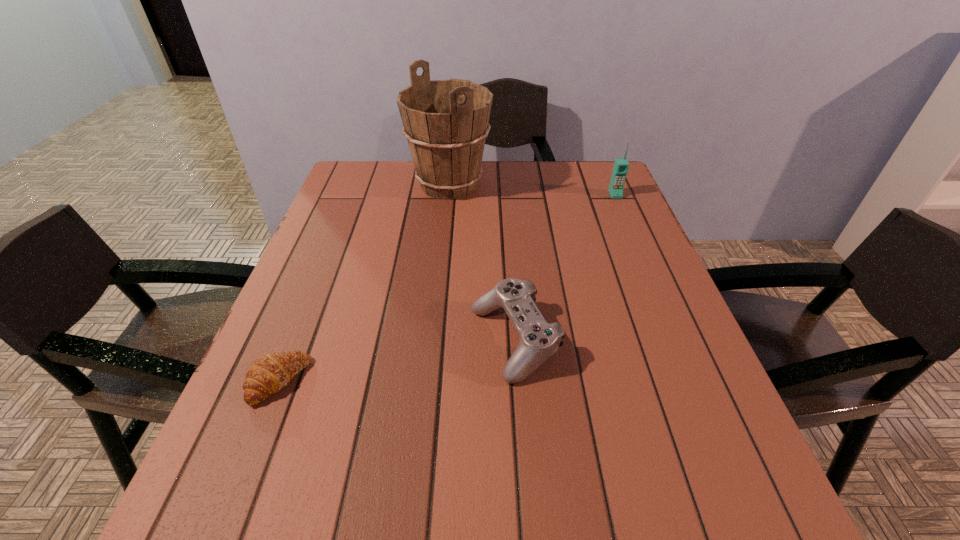
Image resolution: width=960 pixels, height=540 pixels. I want to click on bucket located at the far edge, so click(446, 122).

This screenshot has width=960, height=540. Identify the location of cellular telephone present at the far edge. (621, 165).

You are a GUI agent. You are given a task and a screenshot of the screen. Output one action in this format:
    pyautogui.click(x=<x>, y=<y>)
    Task: Click on the object present at the left edge
    The image size is (960, 540).
    Given the screenshot: What is the action you would take?
    pyautogui.click(x=268, y=374)

Identify the location of object that is at the right edge. This screenshot has height=540, width=960. (621, 165).

In order to click on object that is at the far right corner in this screenshot , I will do `click(621, 165)`.

In the image, there is a desktop. Where is `vacant space at the far edge`? vacant space at the far edge is located at coordinates (403, 167).

Find the location of a particular element. This screenshot has width=960, height=540. vacant area at the near edge of the desktop is located at coordinates (619, 525).

I want to click on free space at the right edge, so click(x=701, y=372).

In the image, there is a desktop. Where is `vacant space at the far left corner`? The height and width of the screenshot is (540, 960). vacant space at the far left corner is located at coordinates [x=381, y=171].

At what (x,y) coordinates should I click in order to perform the action: click on vacant space at the near left corner of the desktop. Please return your answer as a coordinate pair (x, y). The height and width of the screenshot is (540, 960). Looking at the image, I should click on (266, 501).